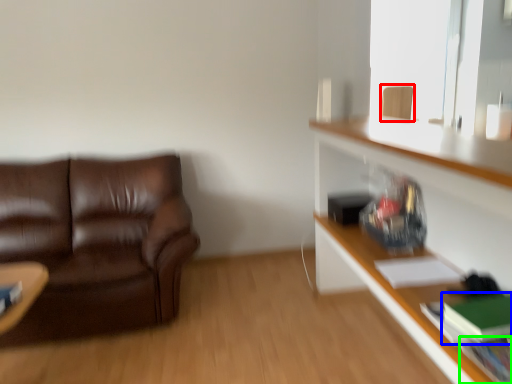
Question: Which object is the farthest from swivel chair (highlighted by a red box)? Choose among these: book (highlighted by a blue box) or book (highlighted by a green box).

Choices:
 (A) book
 (B) book

Answer: (B)